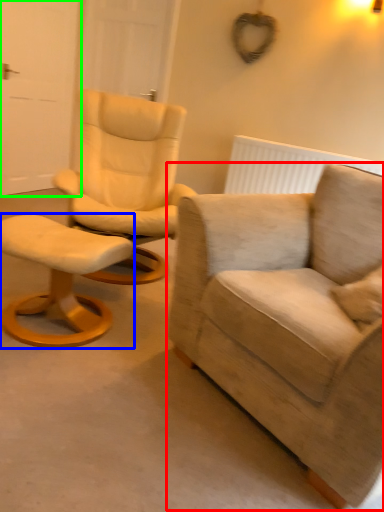
Question: Considering the real-world distances, which object is farthest from chair (highlighted by a red box)? stool (highlighted by a blue box) or door (highlighted by a green box)?

Choices:
 (A) stool
 (B) door

Answer: (B)